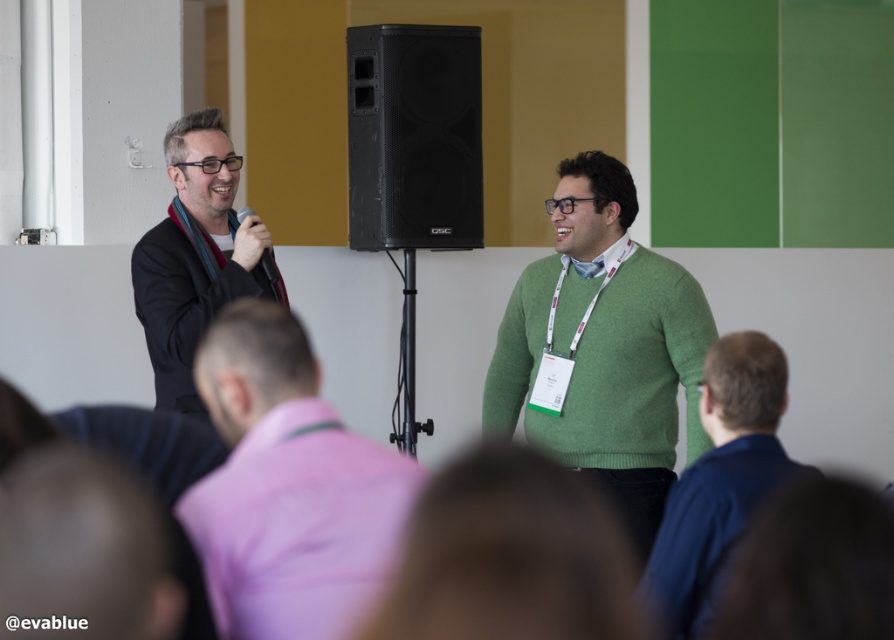
You are standing at the speaker position in the image. There are two points marked on the wall behind you. One is at point coordinates point (233, 573) and the other is at point coordinates point (474, 58). Which point is closer to you?

Point (233, 573) is closer to the viewer than point (474, 58).